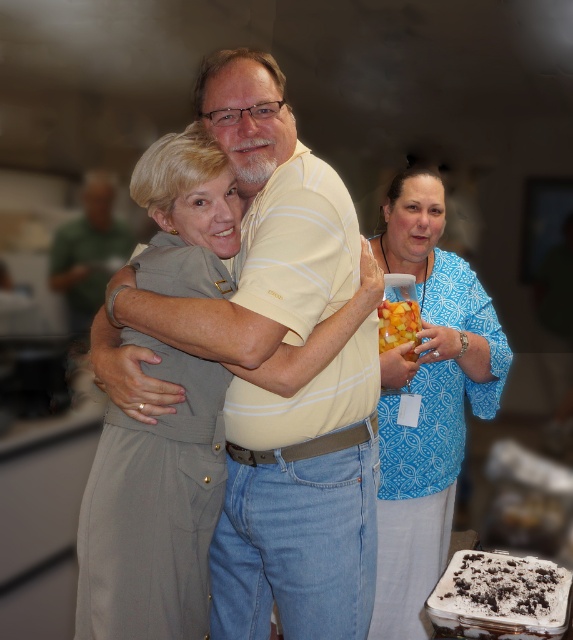
Question: Which point is closer to the camera taking this photo?

Choices:
 (A) pyautogui.click(x=380, y=340)
 (B) pyautogui.click(x=97, y=221)

Answer: (A)

Question: Does white chocolate cake at lower right appear under green fabric shirt at upper left?

Choices:
 (A) yes
 (B) no

Answer: (A)

Question: Which point is farther to the camera?

Choices:
 (A) (453, 420)
 (B) (386, 316)
 (C) (111, 353)

Answer: (A)

Question: Does white chocolate cake at lower right have a smaller size compared to translucent plastic cup at center?

Choices:
 (A) yes
 (B) no

Answer: (B)

Question: Which of the following is the farthest from the observer?

Choices:
 (A) blue patterned blouse at center
 (B) white chocolate cake at lower right
 (C) green fabric shirt at upper left

Answer: (C)

Question: Does white chocolate cake at lower right have a larger size compared to green fabric shirt at upper left?

Choices:
 (A) no
 (B) yes

Answer: (A)